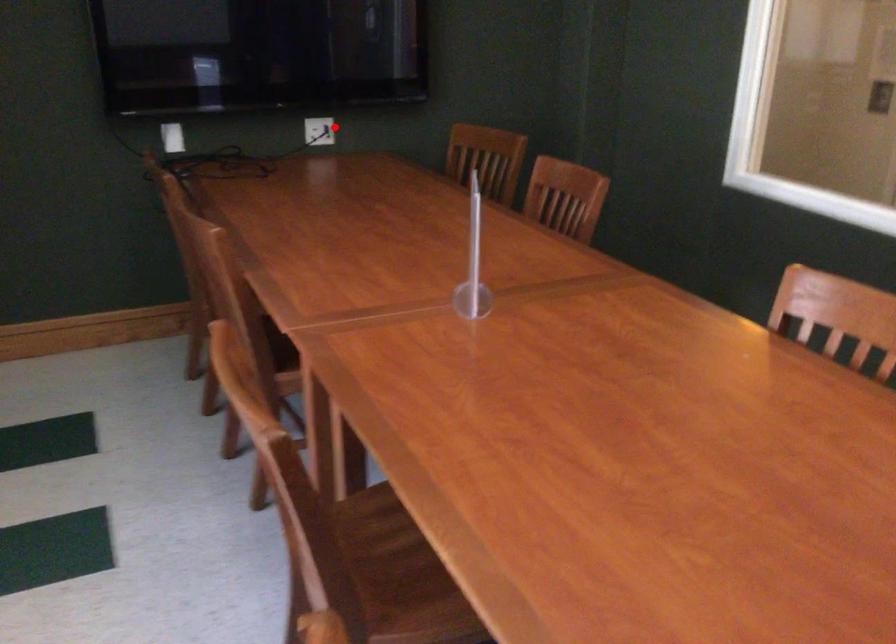
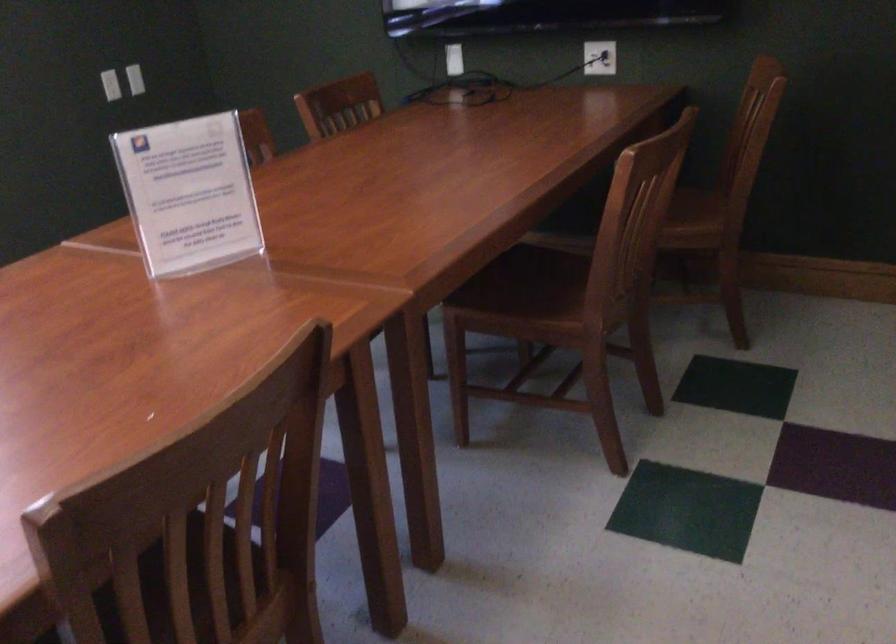
The point at the highlighted location is marked in the first image. Where is the corresponding point in the second image?

(599, 58)